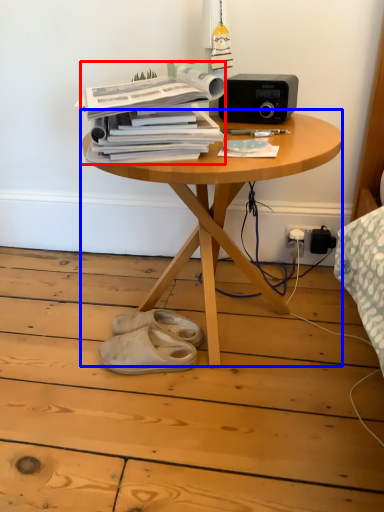
Question: Which object is closer to the camera taking this photo, paperback book (highlighted by a red box) or table (highlighted by a blue box)?

Choices:
 (A) paperback book
 (B) table

Answer: (B)